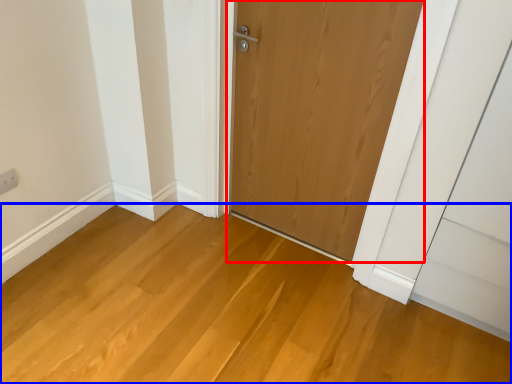
Question: Which object appears closest to the camera in this image, door (highlighted by a red box) or plain (highlighted by a blue box)?

Choices:
 (A) door
 (B) plain

Answer: (B)